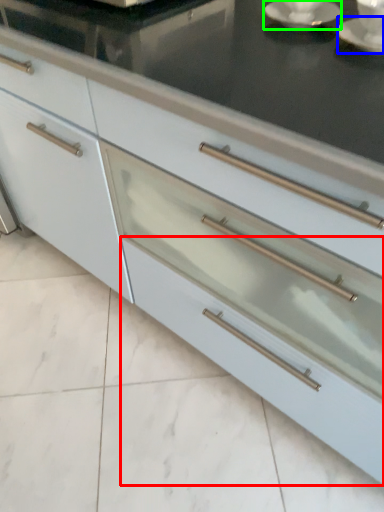
Question: Estimate the real-world distances between objects in this image. Which object is farther from drawer (highlighted by a red box), saucer (highlighted by a blue box) or saucer (highlighted by a green box)?

Choices:
 (A) saucer
 (B) saucer

Answer: (B)